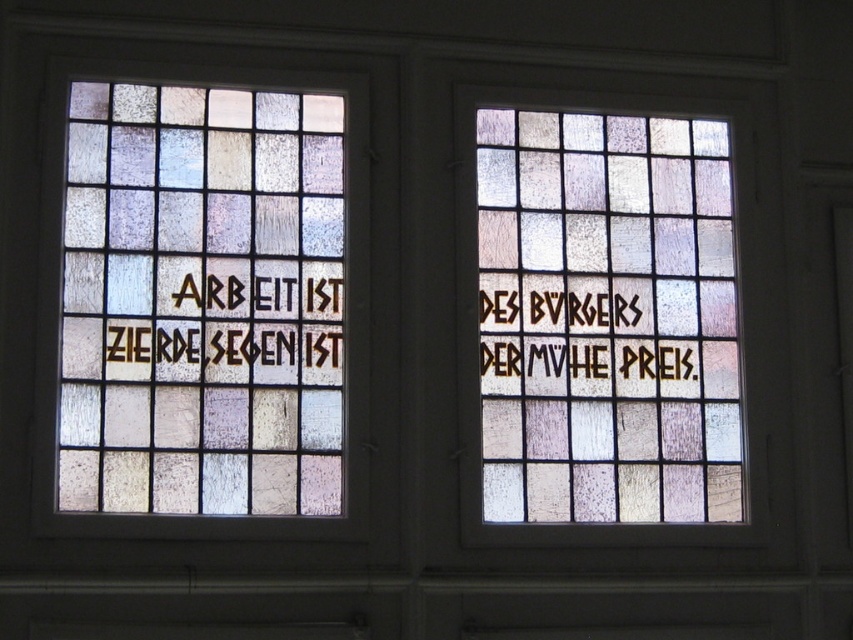
What do you see at coordinates (606, 317) in the screenshot? I see `translucent stained glass at right` at bounding box center [606, 317].

Does translucent stained glass at right appear over brown textured lettering at center right?

Correct, translucent stained glass at right is located above brown textured lettering at center right.

Which is in front, point (651, 152) or point (544, 305)?

Point (544, 305)

I want to click on translucent stained glass at right, so click(606, 317).

The height and width of the screenshot is (640, 853). What do you see at coordinates (223, 346) in the screenshot?
I see `brown textured glass at left` at bounding box center [223, 346].

Who is shorter, brown textured glass at left or brown textured lettering at center right?

brown textured glass at left

Which is in front, point (329, 310) or point (585, 349)?

Point (329, 310) is more forward.

Find the location of a particular element. Image resolution: width=853 pixels, height=640 pixels. brown textured glass at left is located at coordinates (223, 346).

Who is more forward, (78, 243) or (625, 124)?

Point (78, 243)

Is translucent stained glass at left wider than translucent stained glass at right?

No.

The width and height of the screenshot is (853, 640). What do you see at coordinates (201, 301) in the screenshot?
I see `translucent stained glass at left` at bounding box center [201, 301].

This screenshot has width=853, height=640. Find the location of `translucent stained glass at left`. translucent stained glass at left is located at coordinates pos(201,301).